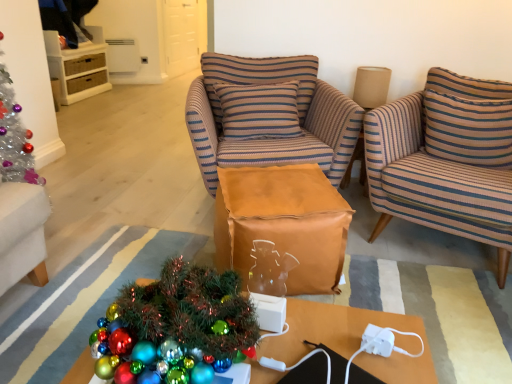
Identify the location of free location to the left of brown paper bag at center. The height and width of the screenshot is (384, 512). (152, 249).